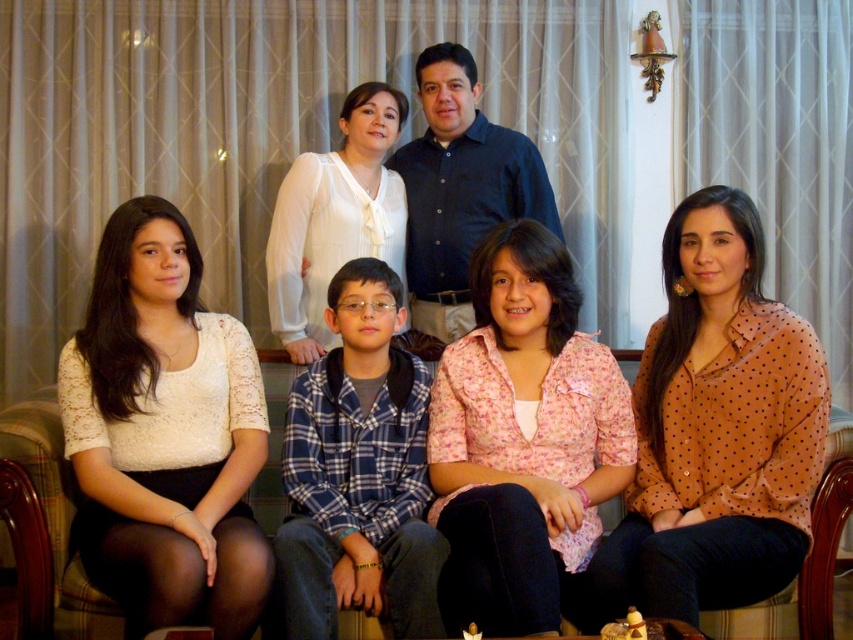
You are standing in the room and want to move from point A to point B. Point A is located at coordinates point (775, 458) and point B is at point (508, 621). Which point is closer to you?

Point A at point (775, 458) is closer to you because it is further to the viewer than point B at point (508, 621).

You are a photographer taking a portrait of the family. You need to ensure that the white lace blouse at lower left and the white sheer blouse at upper center are at least 20 inches apart in the frame. Based on the scene description, is this requirement met?

The white lace blouse at lower left and the white sheer blouse at upper center are 25.88 inches apart, which exceeds the minimum requirement of 20 inches. Therefore, the requirement is met.